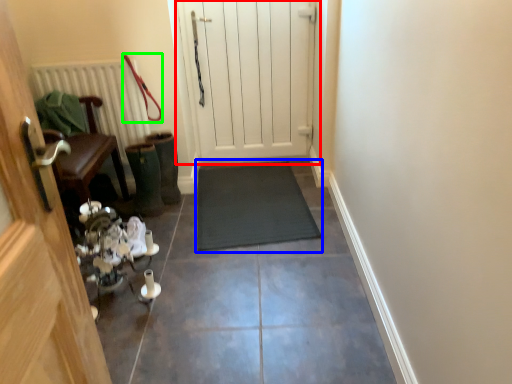
Question: Considering the real-world distances, which object is farthest from door (highlighted by a red box)? doormat (highlighted by a blue box) or leash (highlighted by a green box)?

Choices:
 (A) doormat
 (B) leash

Answer: (B)